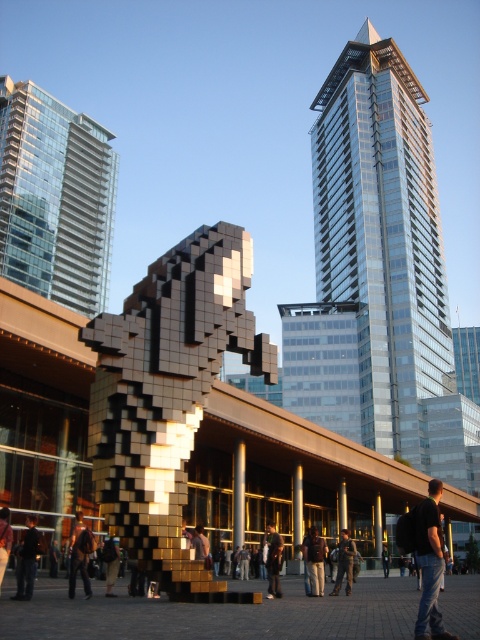
You are an architect planning to install a new sculpture in the city square. The sculpture will be placed between the glassy metallic skyscraper at upper right and the dark gray fabric jacket at center. Which side of the sculpture should face the wider object to ensure proper alignment?

The glassy metallic skyscraper at upper right is wider than the dark gray fabric jacket at center. Therefore, the sculpture should face the glassy metallic skyscraper at upper right to align with its wider structure.

You are a photographer standing in front of the sculpture. You want to capture a photo of the black backpack at lower right without the glassy metallic skyscraper at upper right blocking it. Is this possible?

The glassy metallic skyscraper at upper right is positioned over the black backpack at lower right, so it will block the view. You need to move to a different angle or position to avoid the skyscraper blocking the backpack.

Looking at this image, you are an urban planner reviewing this area and need to determine the spatial relationship between the glassy metallic skyscraper at upper right and the dark gray fabric jacket at center. From the perspective of someone standing at the jacket, which direction would the skyscraper be located?

The glassy metallic skyscraper at upper right is to the right of the dark gray fabric jacket at center, so from the perspective of someone standing at the jacket, the skyscraper would be located to their right side.